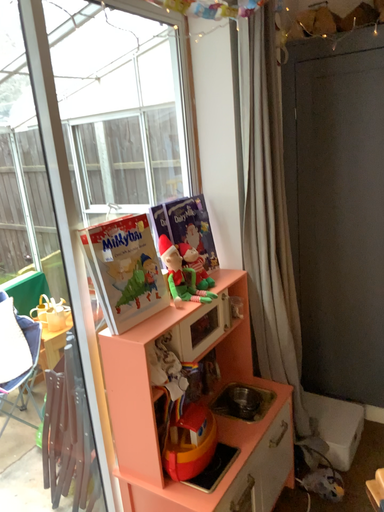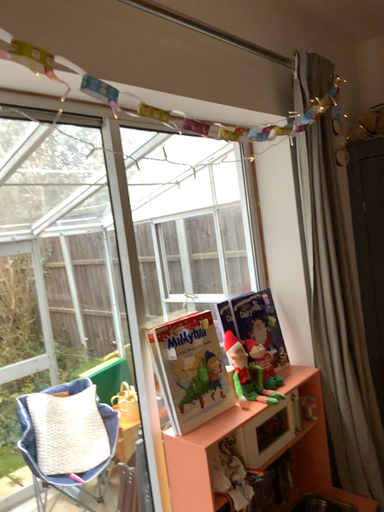
Question: How did the camera likely rotate when shooting the video?

Choices:
 (A) rotated upward
 (B) rotated downward

Answer: (A)